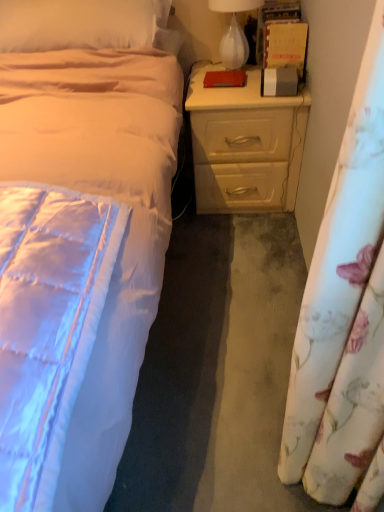
Locate an element on the screen. free point to the left of floral fabric curtain at right is located at coordinates (213, 450).